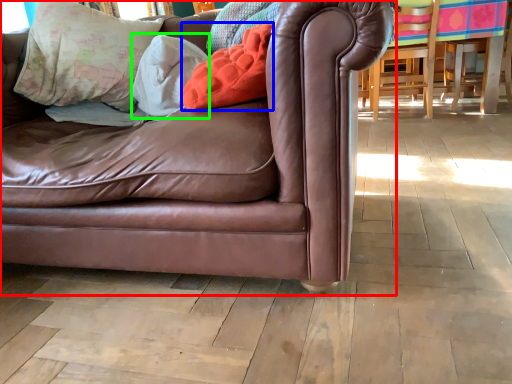
Question: Estimate the real-world distances between objects in this image. Which object is farther from studio couch (highlighted by a red box), pillow (highlighted by a blue box) or pillow (highlighted by a green box)?

Choices:
 (A) pillow
 (B) pillow

Answer: (B)